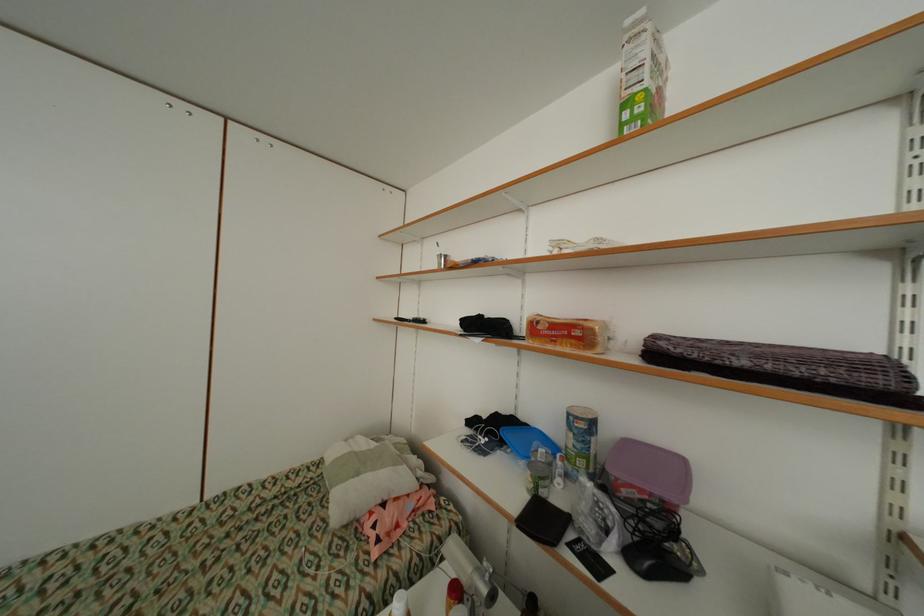
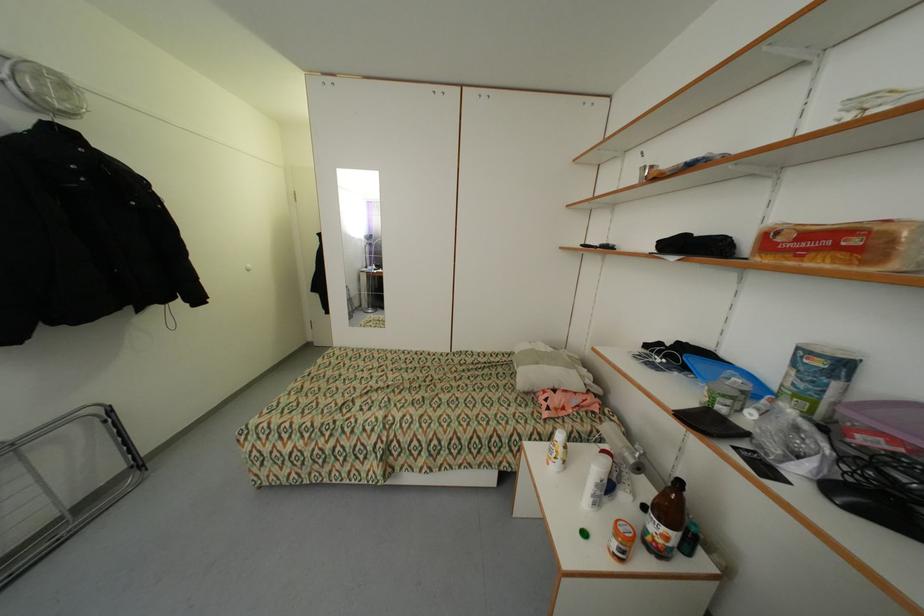
In the second image, find the point that corresponds to (416,322) in the first image.

(602, 248)